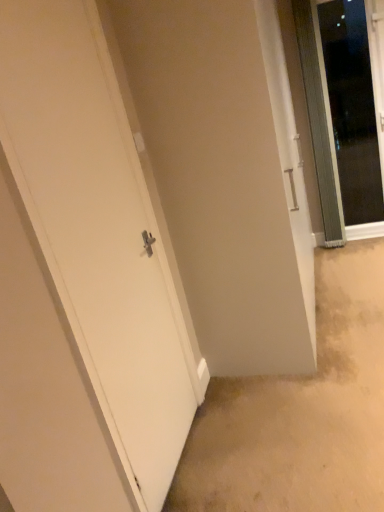
This screenshot has width=384, height=512. What do you see at coordinates (81, 280) in the screenshot?
I see `white matte door at left, placed as the 1th door when sorted from front to back` at bounding box center [81, 280].

You are a GUI agent. You are given a task and a screenshot of the screen. Output one action in this format:
    pyautogui.click(x=<x>, y=<y>)
    Task: Click on the white matte door at left, placed as the 1th door when sorted from front to back
    This screenshot has width=384, height=512.
    Given the screenshot: What is the action you would take?
    pyautogui.click(x=81, y=280)

The width and height of the screenshot is (384, 512). What do you see at coordinates (355, 101) in the screenshot?
I see `transparent glass door at upper right, which is counted as the 2th door, starting from the left` at bounding box center [355, 101].

How much space does transparent glass door at upper right, marked as the first door in a right-to-left arrangement, occupy horizontally?

transparent glass door at upper right, marked as the first door in a right-to-left arrangement, is 0.89 inches in width.

Locate an element on the screen. Image resolution: width=384 pixels, height=512 pixels. transparent glass door at upper right, the first door from the back is located at coordinates (355, 101).

Locate an element on the screen. The image size is (384, 512). white matte door at left, the first door from the left is located at coordinates (81, 280).

Does white matte door at left, the first door from the left, appear on the left side of transparent glass door at upper right, the 2th door positioned from the front?

Yes.

Which is in front, white matte door at left, placed as the 1th door when sorted from front to back, or transparent glass door at upper right, marked as the first door in a right-to-left arrangement?

white matte door at left, placed as the 1th door when sorted from front to back, is in front.

Which is nearer, (76, 282) or (326, 31)?

Point (76, 282) is positioned closer to the camera compared to point (326, 31).

From the image's perspective, which one is positioned lower, white matte door at left, the second door when ordered from right to left, or transparent glass door at upper right, the first door from the back?

white matte door at left, the second door when ordered from right to left, appears lower in the image.

From a real-world perspective, is white matte door at left, the first door from the left, on transparent glass door at upper right, the 2th door positioned from the front?

Actually, white matte door at left, the first door from the left, is physically below transparent glass door at upper right, the 2th door positioned from the front, in the real world.

Considering the sizes of white matte door at left, placed as the 1th door when sorted from front to back, and transparent glass door at upper right, the first door from the back, in the image, is white matte door at left, placed as the 1th door when sorted from front to back, wider or thinner than transparent glass door at upper right, the first door from the back,?

white matte door at left, placed as the 1th door when sorted from front to back, is wider than transparent glass door at upper right, the first door from the back.

Considering the relative sizes of white matte door at left, placed as the 1th door when sorted from front to back, and transparent glass door at upper right, the 2th door positioned from the front, in the image provided, is white matte door at left, placed as the 1th door when sorted from front to back, shorter than transparent glass door at upper right, the 2th door positioned from the front,?

In fact, white matte door at left, placed as the 1th door when sorted from front to back, may be taller than transparent glass door at upper right, the 2th door positioned from the front.

Looking at the image, does white matte door at left, the first door from the left, seem bigger or smaller compared to transparent glass door at upper right, marked as the first door in a right-to-left arrangement?

white matte door at left, the first door from the left, is bigger than transparent glass door at upper right, marked as the first door in a right-to-left arrangement.

Which is correct: white matte door at left, placed as the 1th door when sorted from front to back, is inside transparent glass door at upper right, the 2th door positioned from the front, or outside of it?

white matte door at left, placed as the 1th door when sorted from front to back, is located beyond the bounds of transparent glass door at upper right, the 2th door positioned from the front.

Is white matte door at left, which ranks as the 2th door in back-to-front order, positioned far away from transparent glass door at upper right, the 2th door positioned from the front?

Indeed, white matte door at left, which ranks as the 2th door in back-to-front order, is not near transparent glass door at upper right, the 2th door positioned from the front.

Is white matte door at left, placed as the 1th door when sorted from front to back, positioned with its back to transparent glass door at upper right, the first door from the back?

No, transparent glass door at upper right, the first door from the back, is not at the back of white matte door at left, placed as the 1th door when sorted from front to back.

What's the angular difference between white matte door at left, placed as the 1th door when sorted from front to back, and transparent glass door at upper right, which is counted as the 2th door, starting from the left,'s facing directions?

The angle between the facing direction of white matte door at left, placed as the 1th door when sorted from front to back, and the facing direction of transparent glass door at upper right, which is counted as the 2th door, starting from the left, is 89.9 degrees.

Find the location of a particular element. door on the right of white matte door at left, the second door when ordered from right to left is located at coordinates (355, 101).

Is transparent glass door at upper right, marked as the first door in a right-to-left arrangement, to the right of white matte door at left, the second door when ordered from right to left, from the viewer's perspective?

Indeed, transparent glass door at upper right, marked as the first door in a right-to-left arrangement, is positioned on the right side of white matte door at left, the second door when ordered from right to left.

From the picture: Relative to white matte door at left, placed as the 1th door when sorted from front to back, is transparent glass door at upper right, marked as the first door in a right-to-left arrangement, in front or behind?

In the image, transparent glass door at upper right, marked as the first door in a right-to-left arrangement, appears behind white matte door at left, placed as the 1th door when sorted from front to back.

Is point (362, 212) in front of point (87, 446)?

That is False.

From the image's perspective, who appears lower, transparent glass door at upper right, the 2th door positioned from the front, or white matte door at left, placed as the 1th door when sorted from front to back?

From the image's view, white matte door at left, placed as the 1th door when sorted from front to back, is below.

From a real-world perspective, which object rests below the other?

white matte door at left, the second door when ordered from right to left.

Which of these two, transparent glass door at upper right, marked as the first door in a right-to-left arrangement, or white matte door at left, which ranks as the 2th door in back-to-front order, is wider?

white matte door at left, which ranks as the 2th door in back-to-front order.

Does transparent glass door at upper right, marked as the first door in a right-to-left arrangement, have a greater height compared to white matte door at left, the first door from the left?

No, transparent glass door at upper right, marked as the first door in a right-to-left arrangement, is not taller than white matte door at left, the first door from the left.

Considering the sizes of transparent glass door at upper right, the 2th door positioned from the front, and white matte door at left, the first door from the left, in the image, is transparent glass door at upper right, the 2th door positioned from the front, bigger or smaller than white matte door at left, the first door from the left,?

Clearly, transparent glass door at upper right, the 2th door positioned from the front, is smaller in size than white matte door at left, the first door from the left.

Is transparent glass door at upper right, marked as the first door in a right-to-left arrangement, not inside white matte door at left, the second door when ordered from right to left?

Yes, transparent glass door at upper right, marked as the first door in a right-to-left arrangement, is located beyond the bounds of white matte door at left, the second door when ordered from right to left.

From the picture: Are transparent glass door at upper right, the 2th door positioned from the front, and white matte door at left, placed as the 1th door when sorted from front to back, beside each other?

transparent glass door at upper right, the 2th door positioned from the front, and white matte door at left, placed as the 1th door when sorted from front to back, are not in contact.

Is transparent glass door at upper right, which is counted as the 2th door, starting from the left, aimed at white matte door at left, the second door when ordered from right to left?

No, transparent glass door at upper right, which is counted as the 2th door, starting from the left, is not aimed at white matte door at left, the second door when ordered from right to left.

Identify the location of door below the transparent glass door at upper right, the 2th door positioned from the front (from a real-world perspective). (81, 280).

Find the location of a particular element. The width and height of the screenshot is (384, 512). door above the white matte door at left, placed as the 1th door when sorted from front to back (from a real-world perspective) is located at coordinates (355, 101).

The width and height of the screenshot is (384, 512). I want to click on door that is above the white matte door at left, the first door from the left (from the image's perspective), so click(355, 101).